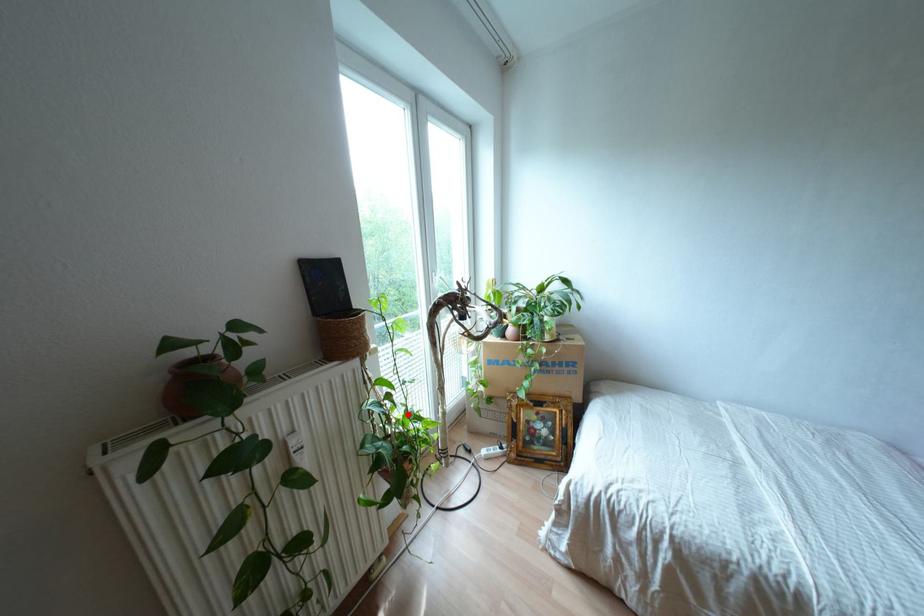
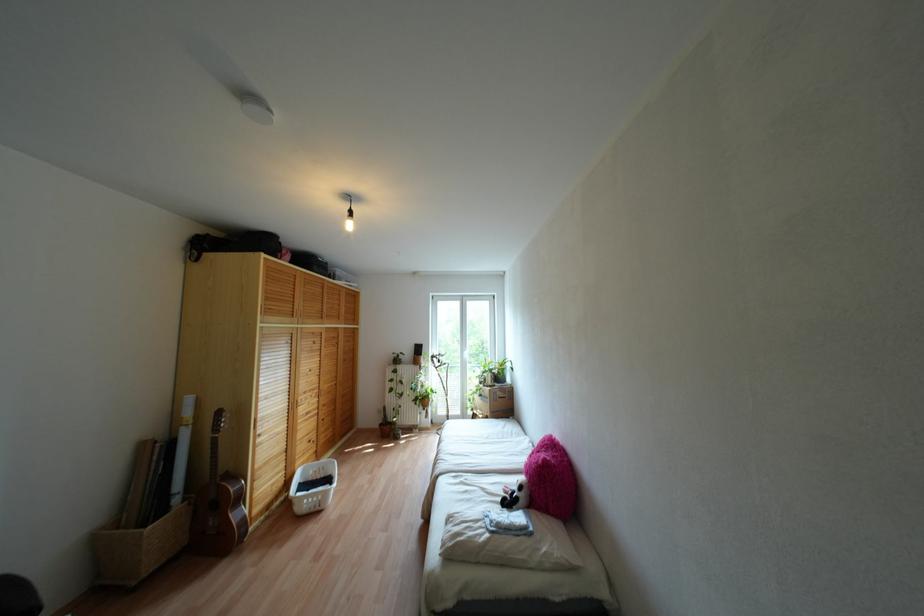
Find the pixel in the second image that matches the highlighted location in the first image.

(431, 389)